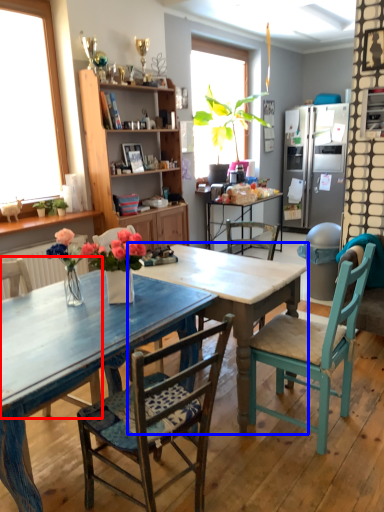
Question: Which point is closer to the camera, chair (highlighted by a red box) or table (highlighted by a blue box)?

Choices:
 (A) chair
 (B) table

Answer: (A)